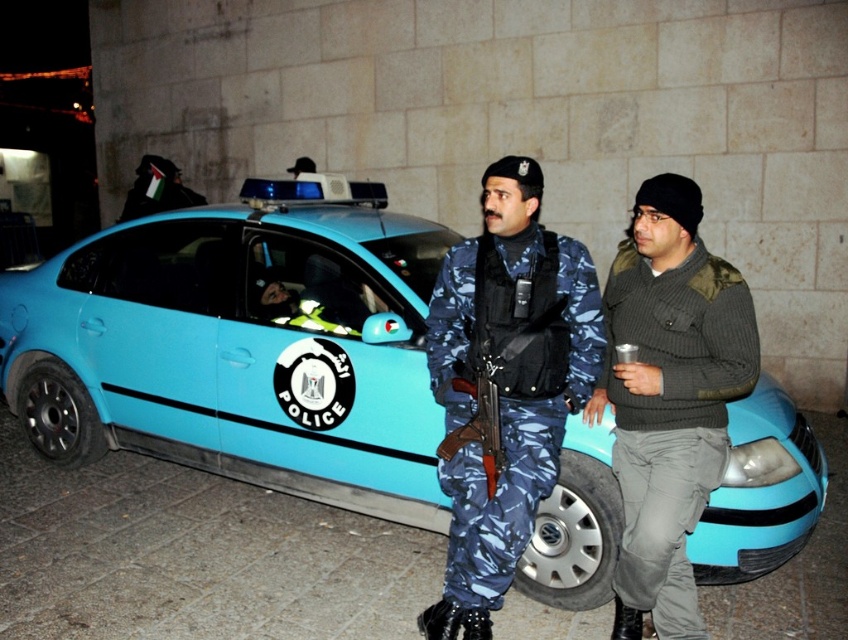
Is light blue plastic car at center smaller than camouflage uniform at center?

No, light blue plastic car at center is not smaller than camouflage uniform at center.

Between light blue plastic car at center and camouflage uniform at center, which one appears on the left side from the viewer's perspective?

light blue plastic car at center is more to the left.

Identify the location of light blue plastic car at center. Image resolution: width=848 pixels, height=640 pixels. (241, 348).

Who is lower down, light blue plastic car at center or knit sweater at center?

Positioned lower is knit sweater at center.

Is light blue plastic car at center taller than knit sweater at center?

Indeed, light blue plastic car at center has a greater height compared to knit sweater at center.

Between point (65, 252) and point (612, 356), which one is positioned behind?

The point (65, 252) is behind.

The height and width of the screenshot is (640, 848). Find the location of `light blue plastic car at center`. light blue plastic car at center is located at coordinates (241, 348).

Between point (688, 396) and point (673, 604), which one is positioned behind?

The point (673, 604) is more distant.

Does point (699, 291) lie behind point (664, 593)?

That is False.

You are a GUI agent. You are given a task and a screenshot of the screen. Output one action in this format:
    pyautogui.click(x=<x>, y=<y>)
    Task: Click on the camouflage uniform at center
    
    Given the screenshot: What is the action you would take?
    pyautogui.click(x=668, y=397)